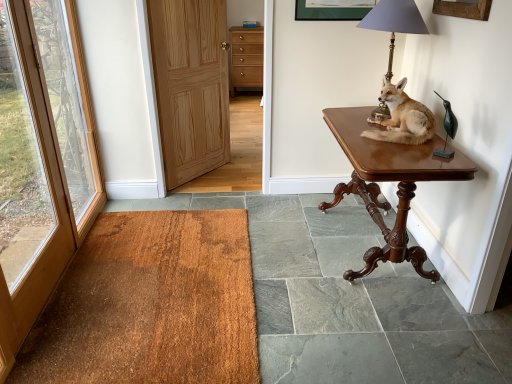
Where is `spots to the right of brown textured mat at lower left`? Image resolution: width=512 pixels, height=384 pixels. spots to the right of brown textured mat at lower left is located at coordinates (330, 281).